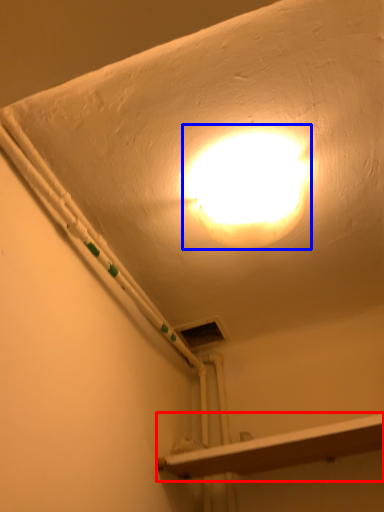
Question: Which of the following is the closest to the observer, shelf (highlighted by a red box) or lamp (highlighted by a blue box)?

Choices:
 (A) shelf
 (B) lamp

Answer: (B)